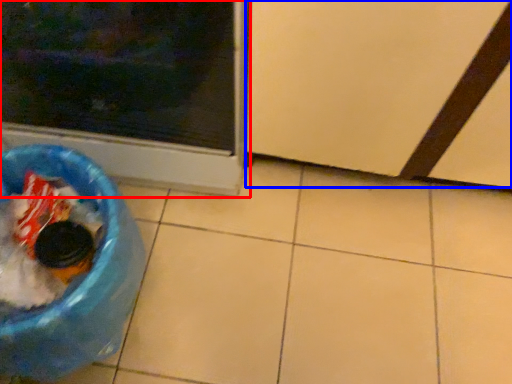
Question: Which point is closer to the camera, home appliance (highlighted by a red box) or screen door (highlighted by a blue box)?

Choices:
 (A) home appliance
 (B) screen door

Answer: (A)